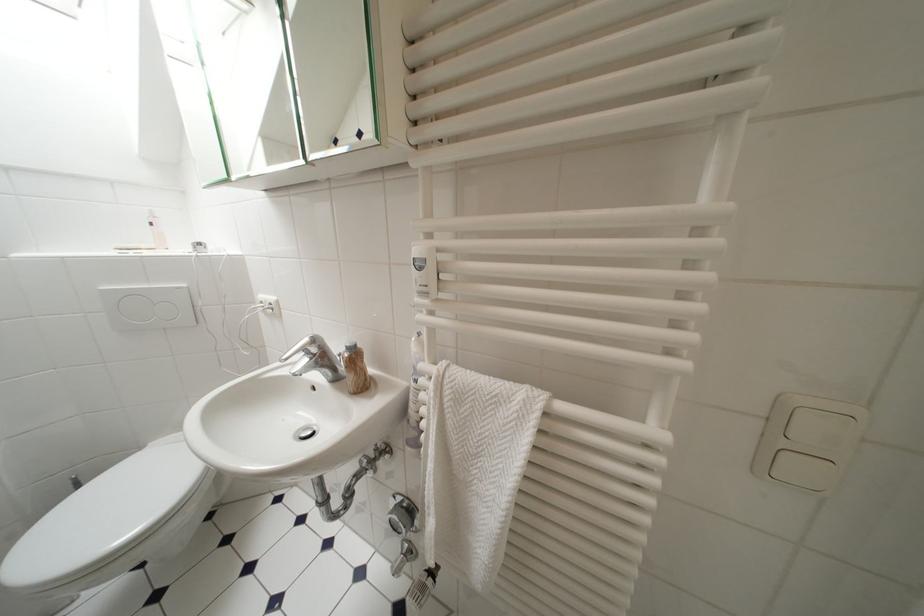
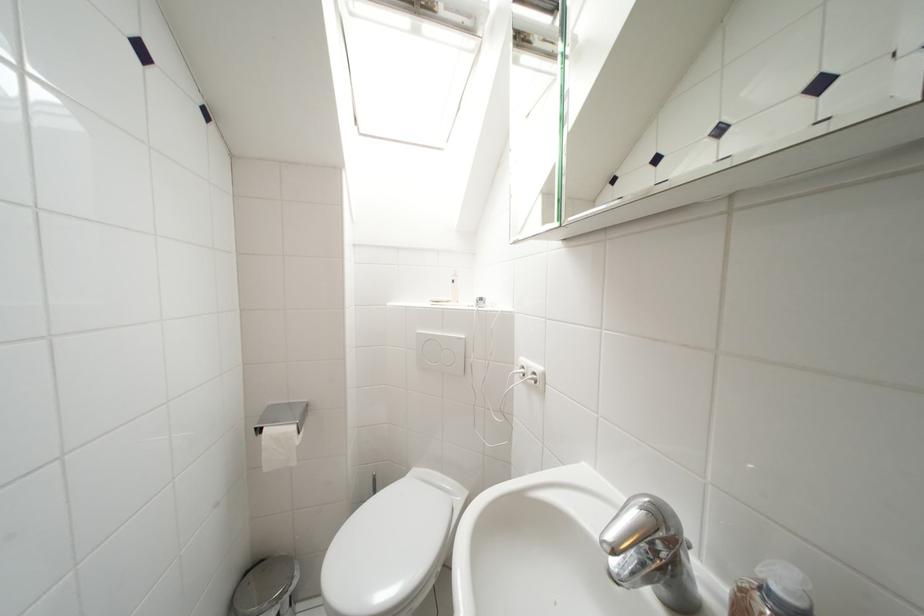
Question: The camera is either moving clockwise (left) or counter-clockwise (right) around the object. The first image is from the beginning of the video and the second image is from the end. Is the camera moving left or right when shooting the video?

Choices:
 (A) Left
 (B) Right

Answer: (B)